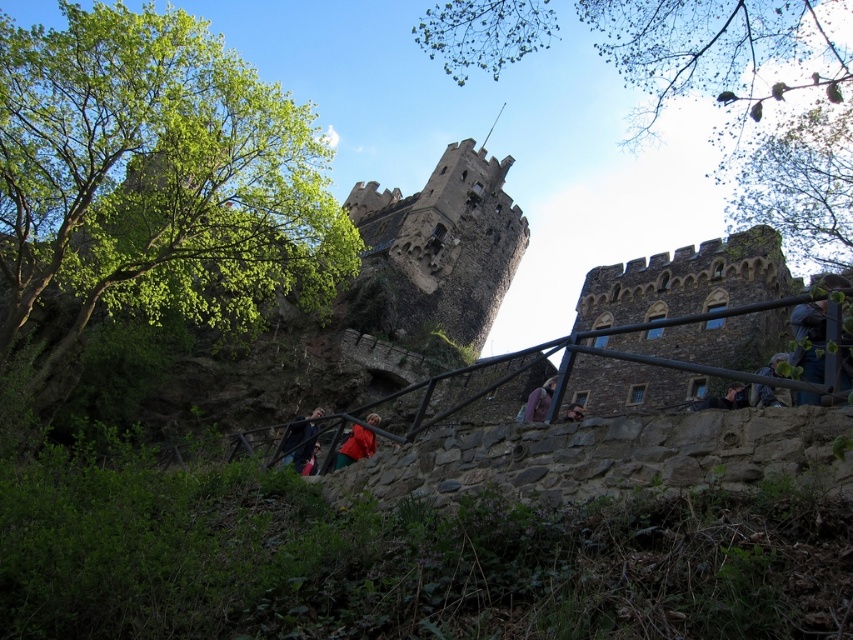
Is dark blue fabric jacket at lower center thinner than dark blue jacket at center?

In fact, dark blue fabric jacket at lower center might be wider than dark blue jacket at center.

Based on the photo, between dark blue fabric jacket at lower center and dark blue jacket at center, which one appears on the left side from the viewer's perspective?

dark blue fabric jacket at lower center is more to the left.

Which is behind, point (291, 426) or point (575, 410)?

Positioned behind is point (291, 426).

This screenshot has height=640, width=853. Identify the location of dark blue fabric jacket at lower center. (300, 440).

Is stone tower at center taller than green fabric jacket at lower right?

Indeed, stone tower at center has a greater height compared to green fabric jacket at lower right.

Between point (477, 172) and point (767, 387), which one is positioned in front?

Point (767, 387) is in front.

Locate an element on the screen. This screenshot has height=640, width=853. stone tower at center is located at coordinates (438, 250).

Who is lower down, dark blue fabric jacket at lower center or purple fabric at center?

Positioned lower is dark blue fabric jacket at lower center.

This screenshot has width=853, height=640. What are the coordinates of `dark blue fabric jacket at lower center` in the screenshot? It's located at (300, 440).

Between point (314, 422) and point (543, 412), which one is positioned behind?

Positioned behind is point (314, 422).

Identify the location of dark blue fabric jacket at lower center. (300, 440).